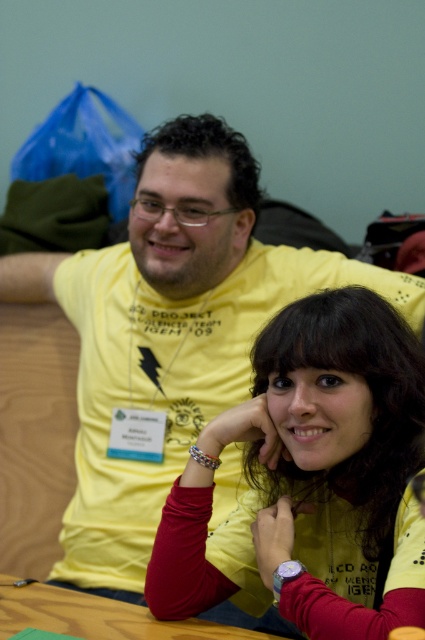
Question: Is matte yellow shirt at center to the left of multicolored fabric bracelet at lower center from the viewer's perspective?

Choices:
 (A) no
 (B) yes

Answer: (A)

Question: Does matte yellow shirt at center have a greater width compared to multicolored fabric bracelet at lower center?

Choices:
 (A) yes
 (B) no

Answer: (A)

Question: Which object is the closest to the multicolored fabric bracelet at lower center?

Choices:
 (A) matte yellow shirt at center
 (B) metallic bracelet at lower center

Answer: (A)

Question: Which point appears closest to the camera in this image?

Choices:
 (A) (342, 620)
 (B) (201, 461)
 (C) (280, 577)

Answer: (A)

Question: Which is nearer to the multicolored fabric bracelet at lower center?

Choices:
 (A) matte yellow shirt at center
 (B) metallic bracelet at lower center

Answer: (A)

Question: Is matte yellow shirt at center further to the viewer compared to multicolored fabric bracelet at lower center?

Choices:
 (A) yes
 (B) no

Answer: (B)